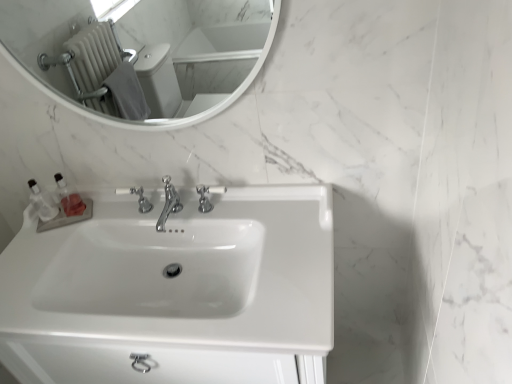
Locate an element on the screen. This screenshot has height=384, width=512. free space to the left of clear plastic bottles at left, the 1th toiletry when ordered from right to left is located at coordinates (36, 227).